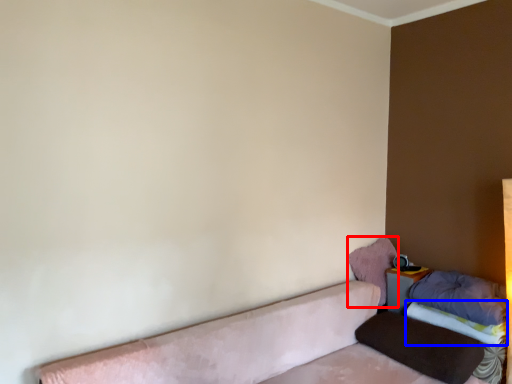
Question: Which point is closer to the camera, pillow (highlighted by a red box) or sheet (highlighted by a blue box)?

Choices:
 (A) pillow
 (B) sheet

Answer: (B)